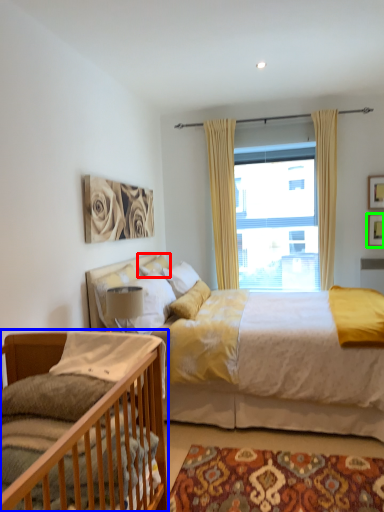
Question: Which object is positioned closest to pillow (highlighted by a red box)? Select from bed (highlighted by a blue box) and picture frame (highlighted by a green box).

Choices:
 (A) bed
 (B) picture frame

Answer: (A)